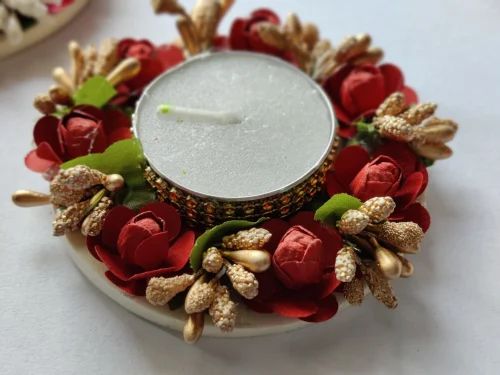
Where is `white plate`? The height and width of the screenshot is (375, 500). white plate is located at coordinates (268, 329).